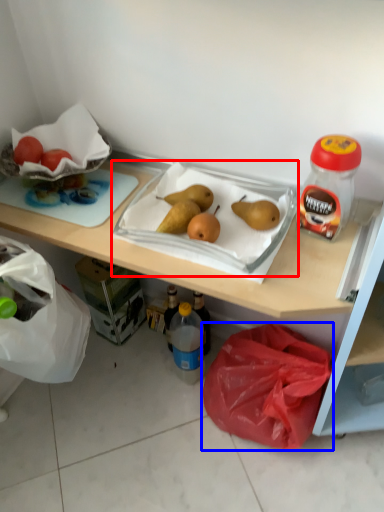
Question: Which of the following is the farthest to the observer, wide (highlighted by a red box) or plastic bag (highlighted by a blue box)?

Choices:
 (A) wide
 (B) plastic bag

Answer: (B)